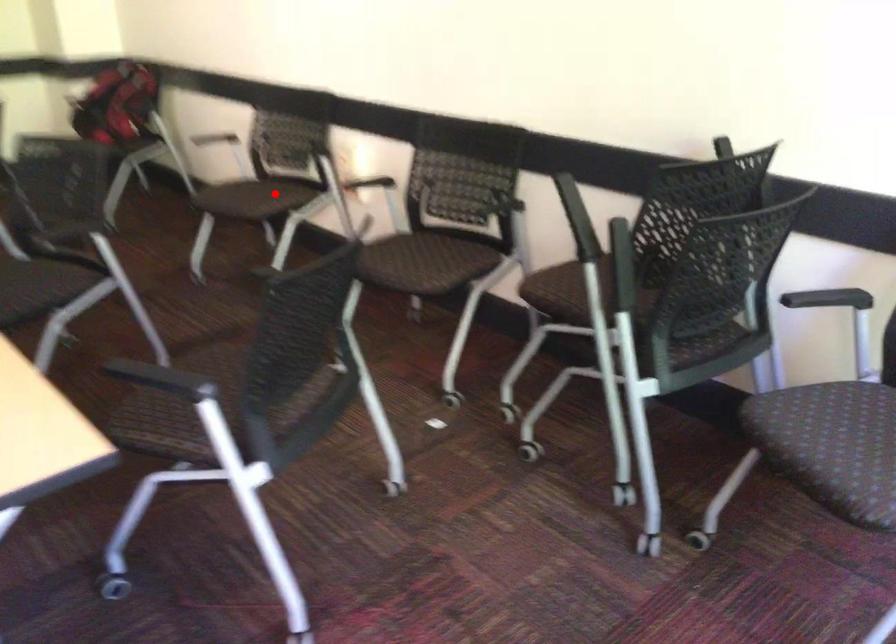
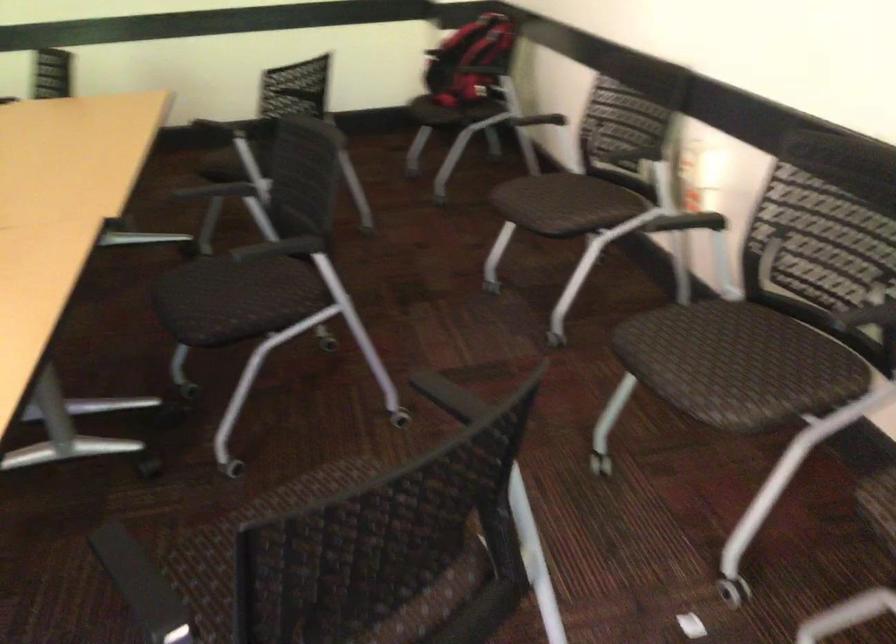
Question: I am providing you with two images of the same scene from different viewpoints. Image1 has a red point marked. In image2, the corresponding 3D location appears at what relative position? Reply with the corresponding letter.

Choices:
 (A) Closer
 (B) Farther

Answer: (A)